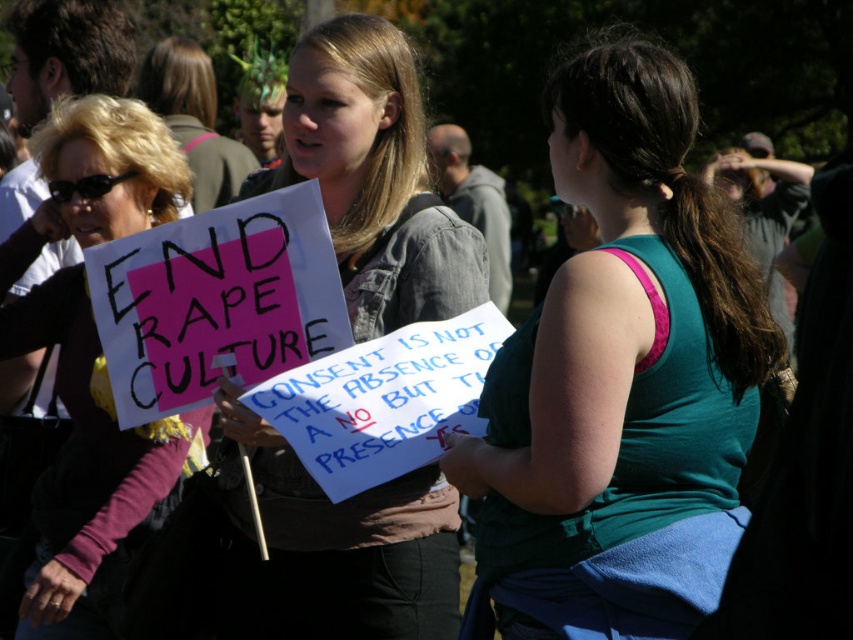
You are a photographer trying to capture the protest scene. You notice the teal fabric tank top at center and the blonde hair at upper left. Which one is positioned to the right of the other?

The teal fabric tank top at center is positioned to the right of the blonde hair at upper left.

You are a photographer trying to capture the protest scene. You notice the teal fabric tank top at center and the denim jacket at center. Which one should you focus on to get a clearer image of the person in the front?

The teal fabric tank top at center is closer to the viewer than the denim jacket at center, so focusing on the teal fabric tank top at center would capture the person in the front more clearly.

Consider the image. You are a photographer trying to capture a clear photo of both the matte black sign at left and the blonde hair at upper left. Can you fit both into the frame without moving your camera position?

The matte black sign at left and the blonde hair at upper left are 2.67 meters apart, so if your camera has a wide enough lens to capture a 2.67 meter span, then yes, both can be included in the frame without moving the camera position.